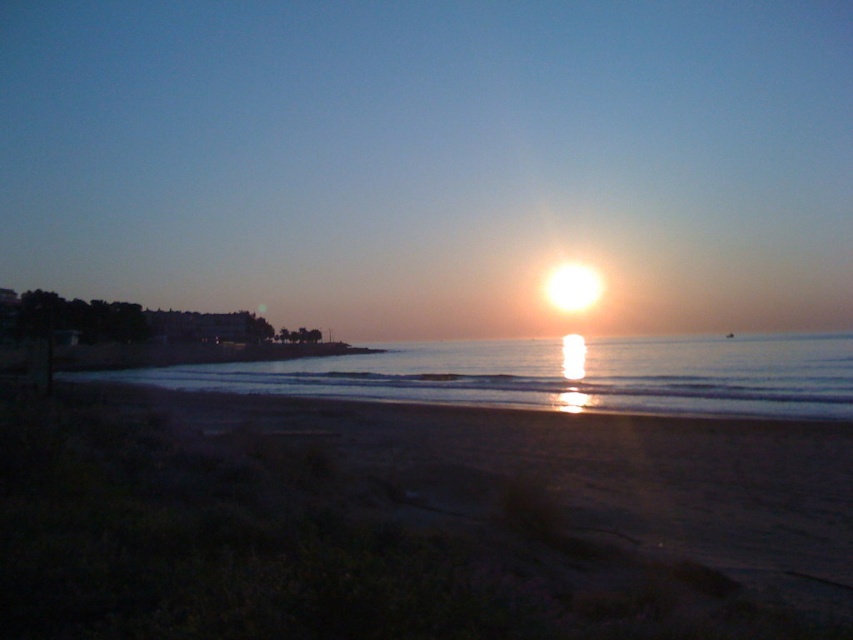
Describe the element at coordinates (412, 522) in the screenshot. I see `sandy beach at lower left` at that location.

Who is lower down, sandy beach at lower left or smooth water at center?

smooth water at center is lower down.

Is point (80, 544) in front of point (531, 387)?

Yes, point (80, 544) is closer to viewer.

The width and height of the screenshot is (853, 640). I want to click on sandy beach at lower left, so click(412, 522).